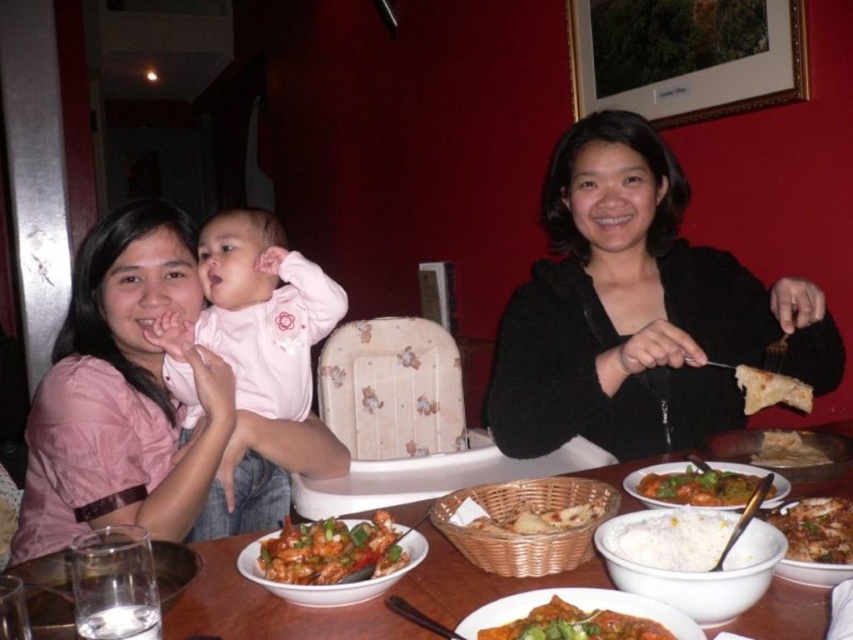
Question: Which point is farther to the camera?

Choices:
 (A) click(x=805, y=515)
 (B) click(x=538, y=605)

Answer: (A)

Question: Can you confirm if white ceramic bowl at center is smaller than white rice at center?

Choices:
 (A) yes
 (B) no

Answer: (B)

Question: Which is nearer to the green curry paste at center?

Choices:
 (A) pink fabric shirt at left
 (B) black matte sweater at upper right
 (C) white matte rice at center
 (D) white ceramic bowl at center

Answer: (C)

Question: Which object is closer to the camera taking this photo?

Choices:
 (A) white rice at center
 (B) green curry paste at center
 (C) white ceramic bowl at center
 (D) golden brown flatbread at right

Answer: (C)

Question: Is black matte sweater at upper right further to camera compared to green curry paste at center?

Choices:
 (A) yes
 (B) no

Answer: (A)

Question: Is pink fabric shirt at left in front of golden brown flatbread at right?

Choices:
 (A) no
 (B) yes

Answer: (A)